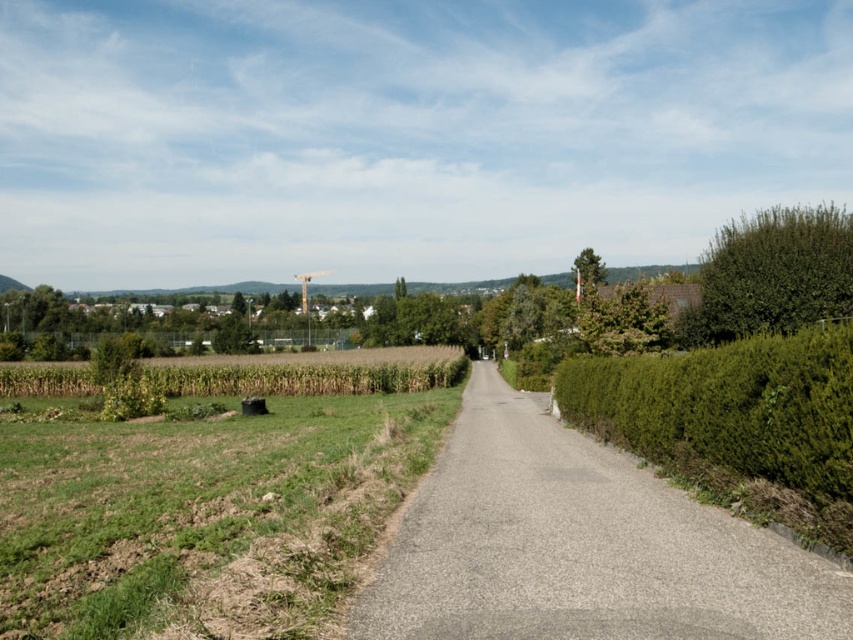
Can you confirm if green grassy field at left is wider than green leafy bush at right?

In fact, green grassy field at left might be narrower than green leafy bush at right.

Is point (161, 589) less distant than point (784, 323)?

Yes, it is in front of point (784, 323).

Between point (339, 557) and point (705, 273), which one is positioned in front?

Point (339, 557)

Locate an element on the screen. green grassy field at left is located at coordinates (201, 513).

What do you see at coordinates (201, 513) in the screenshot?
I see `green grassy field at left` at bounding box center [201, 513].

Is green grassy field at left wider than gray asphalt road at center?

Correct, the width of green grassy field at left exceeds that of gray asphalt road at center.

What do you see at coordinates (201, 513) in the screenshot?
I see `green grassy field at left` at bounding box center [201, 513].

Find the location of a particular element. The width and height of the screenshot is (853, 640). green grassy field at left is located at coordinates (201, 513).

Who is more forward, (x=728, y=321) or (x=596, y=257)?

Point (x=728, y=321) is in front.

Who is more forward, (752, 243) or (599, 257)?

Point (752, 243) is in front.

This screenshot has height=640, width=853. In order to click on green leafy bush at right in this screenshot , I will do `click(772, 275)`.